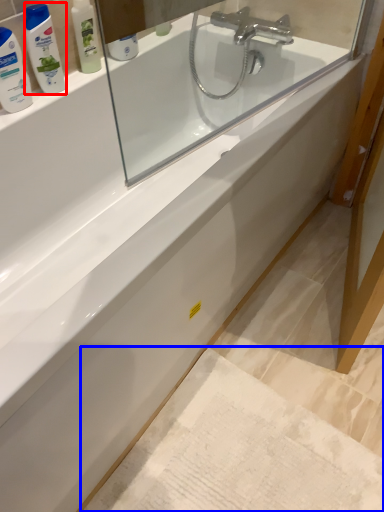
Question: Among these objects, which one is nearest to the camera, mouthwash (highlighted by a red box) or bath mat (highlighted by a blue box)?

Choices:
 (A) mouthwash
 (B) bath mat

Answer: (B)